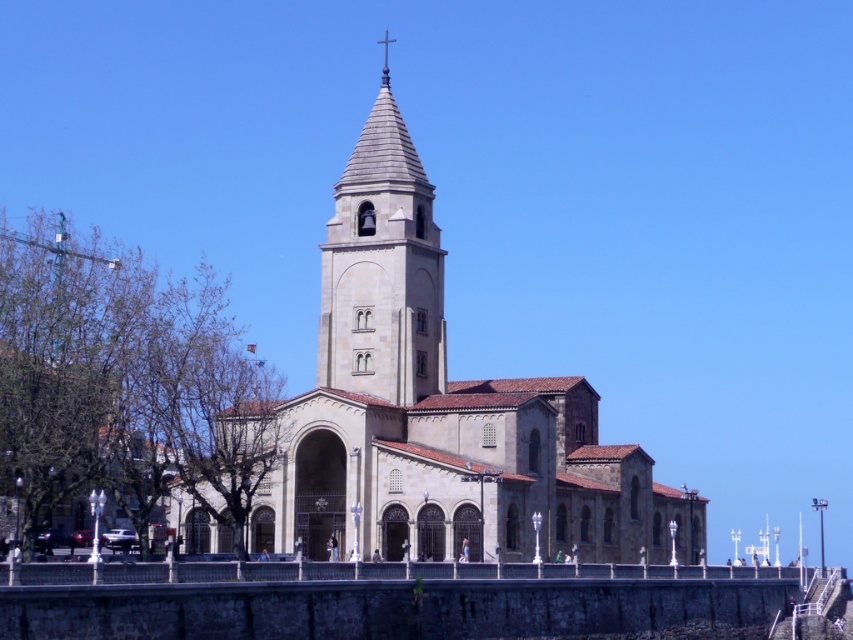
You are standing in front of the grand historic church and want to locate the exact point at coordinates point (440,412). Based on the scene description, which architectural feature is located at this point?

The point (440,412) corresponds to the stone church at center, as stated in the objects description.

You are a tourist standing in front of the church and want to take a photo that includes both the stone church at center and the gray stone bell tower at center. Which one should you focus on to ensure both are in frame without zooming in or out?

The stone church at center is taller than the gray stone bell tower at center, so you should focus on the stone church at center to ensure both are in frame without needing to adjust the zoom.